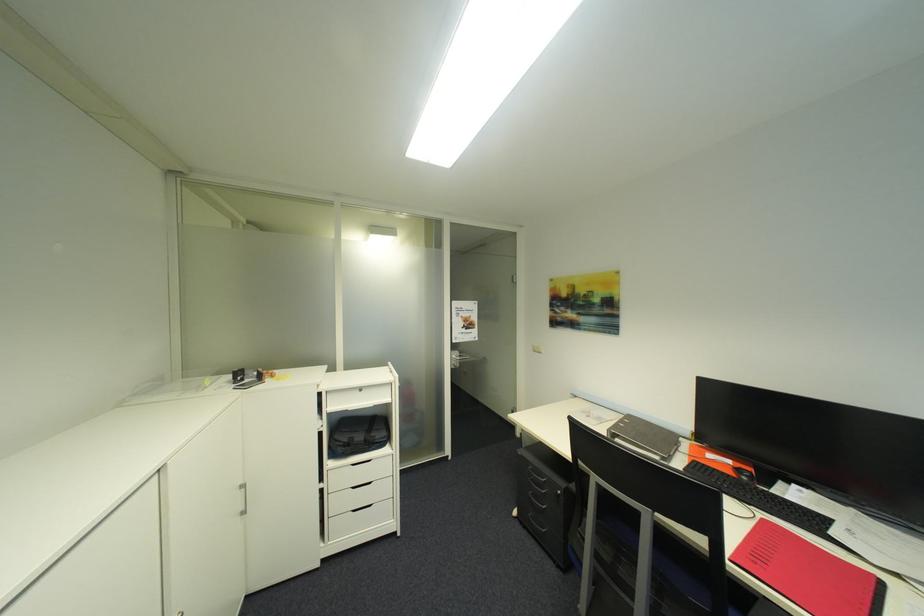
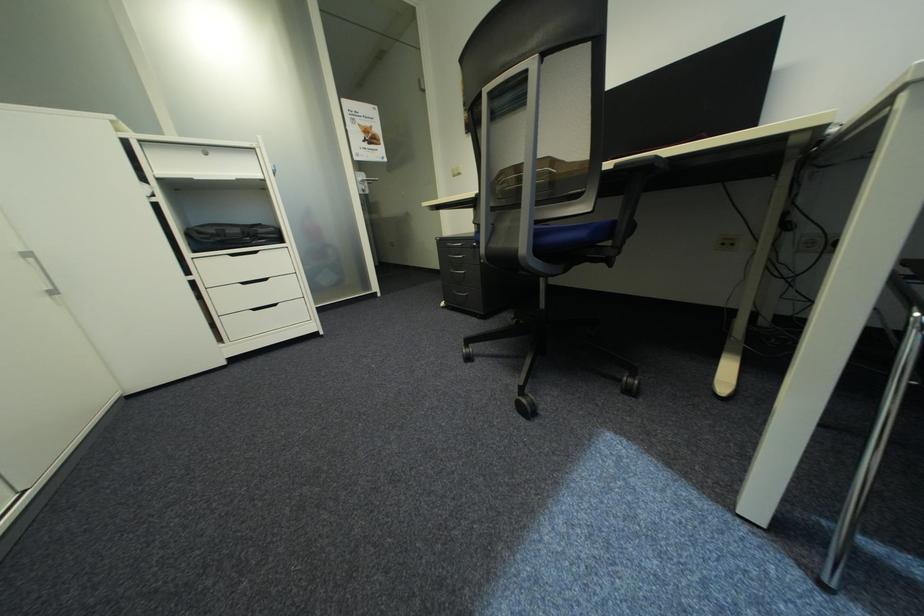
Question: The first image is from the beginning of the video and the second image is from the end. How did the camera likely rotate when shooting the video?

Choices:
 (A) Left
 (B) Right
 (C) Up
 (D) Down

Answer: (D)